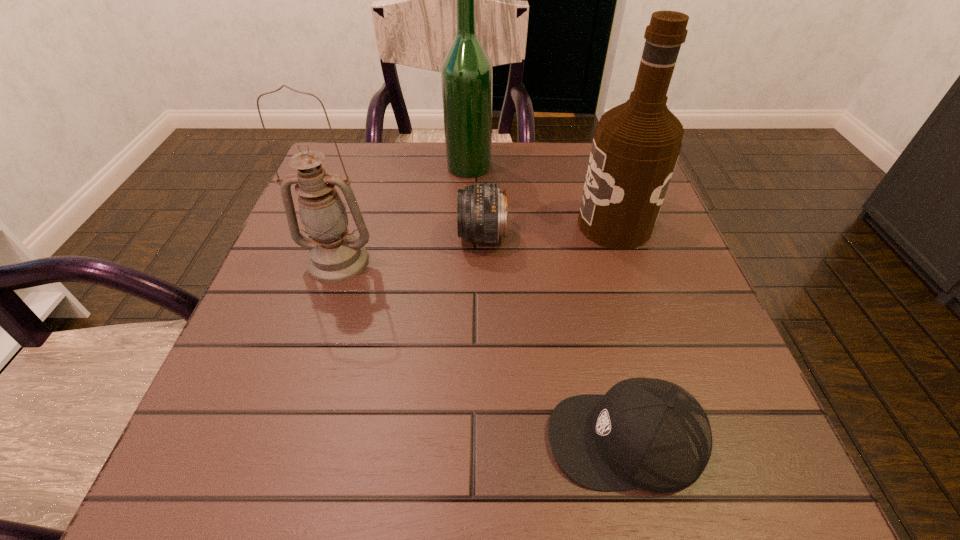
Identify the location of vacant area that lies between the right alcohol and the third shortest object. (476, 243).

Select which object appears as the third closest to the farthest object. Please provide its 2D coordinates. Your answer should be formatted as a tuple, i.e. [(x, y)], where the tuple contains the x and y coordinates of a point satisfying the conditions above.

[(335, 255)]

Identify which object is the third nearest to the nearer alcohol. Please provide its 2D coordinates. Your answer should be formatted as a tuple, i.e. [(x, y)], where the tuple contains the x and y coordinates of a point satisfying the conditions above.

[(646, 433)]

Locate an element on the screen. The image size is (960, 540). blank area in the image that satisfies the following two spatial constraints: 1. on the back side of the oil lamp; 2. on the right side of the farthest object is located at coordinates (369, 166).